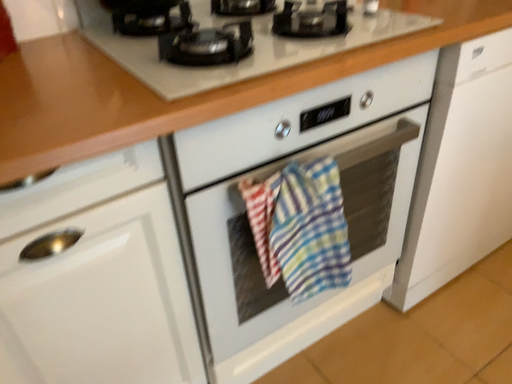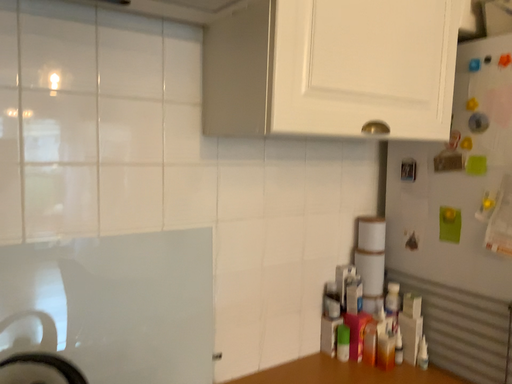
Question: Which way did the camera rotate in the video?

Choices:
 (A) rotated downward
 (B) rotated upward

Answer: (B)